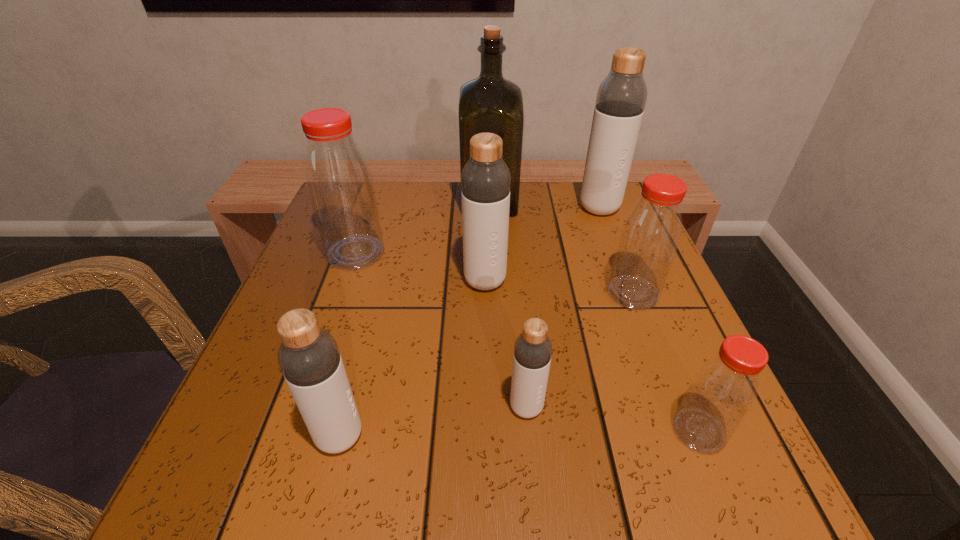
I want to click on liquor present at the far edge, so click(488, 104).

This screenshot has width=960, height=540. What are the coordinates of `bottle located in the far edge section of the desktop` in the screenshot? It's located at (621, 97).

You are a GUI agent. You are given a task and a screenshot of the screen. Output one action in this format:
    pyautogui.click(x=<x>, y=<y>)
    Task: Click on the object that is at the near left corner
    The width and height of the screenshot is (960, 540).
    Given the screenshot: What is the action you would take?
    [309, 358]

Find the location of `object that is at the far right corner`. object that is at the far right corner is located at coordinates (621, 97).

This screenshot has height=540, width=960. I want to click on object situated at the near right corner, so click(x=724, y=388).

Identify the location of free space at the far edge. The height and width of the screenshot is (540, 960). (559, 187).

Where is `blank space at the near edge of the desktop`? The width and height of the screenshot is (960, 540). blank space at the near edge of the desktop is located at coordinates (614, 456).

You are a GUI agent. You are given a task and a screenshot of the screen. Output one action in this format:
    pyautogui.click(x=<x>, y=<y>)
    Task: Click on the free region at the left edge of the desktop
    The height and width of the screenshot is (540, 960).
    Given the screenshot: What is the action you would take?
    pyautogui.click(x=276, y=313)

You are a GUI agent. You are given a task and a screenshot of the screen. Output one action in this format:
    pyautogui.click(x=<x>, y=<y>)
    Task: Click on the free spot at the right edge of the desktop
    The width and height of the screenshot is (960, 540).
    Given the screenshot: What is the action you would take?
    pyautogui.click(x=674, y=373)

This screenshot has height=540, width=960. I want to click on free space at the near left corner of the desktop, so click(200, 493).